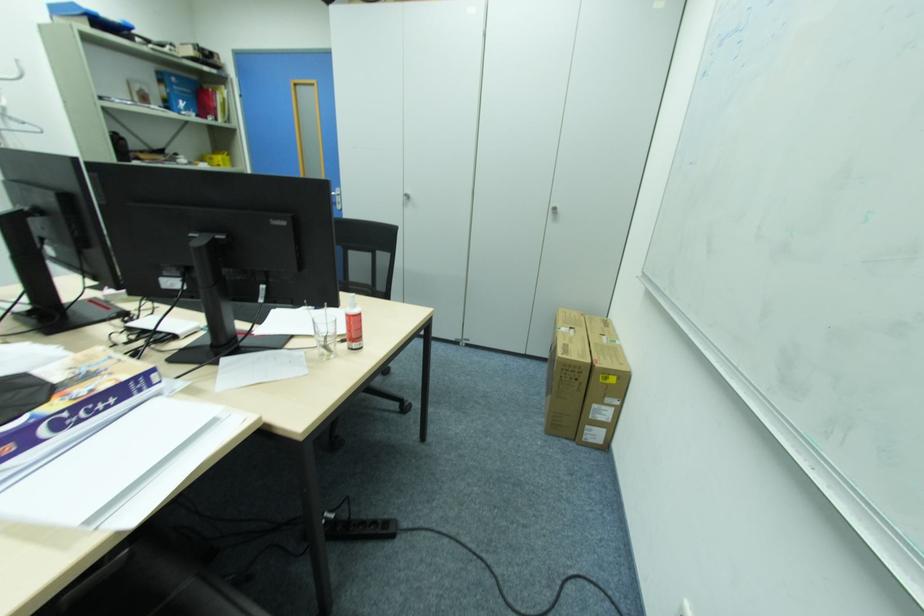
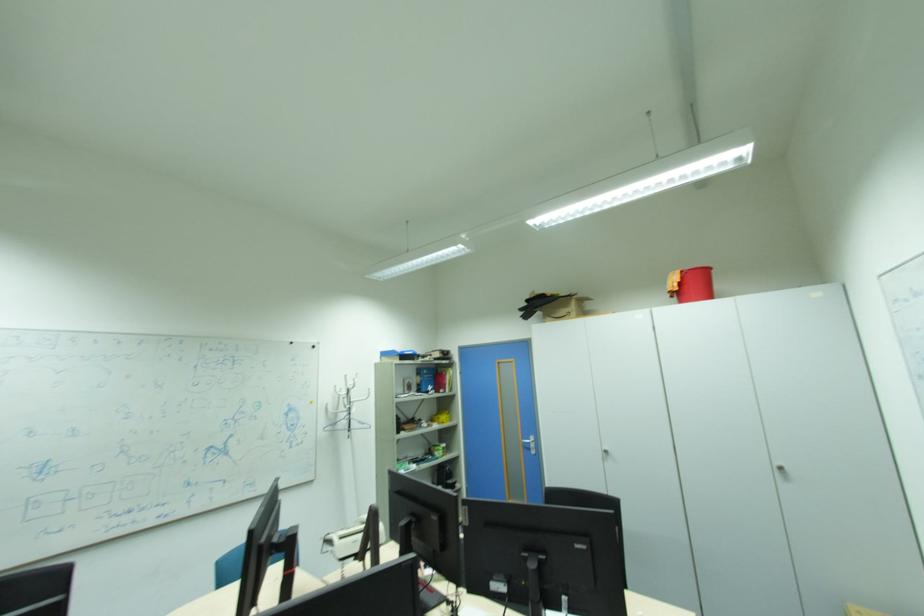
Based on the continuous images, in which direction is the camera rotating?

The rotation direction of the camera is left-up.